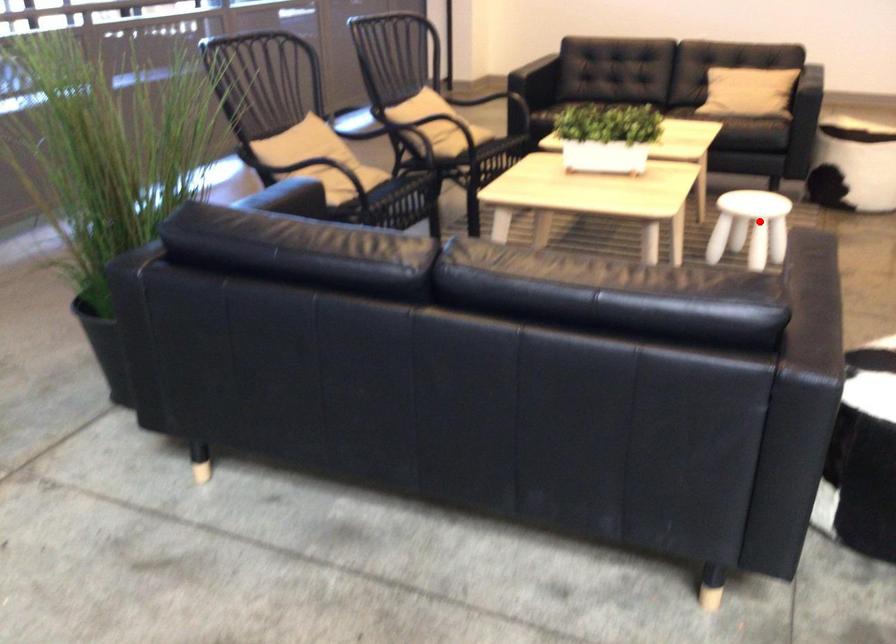
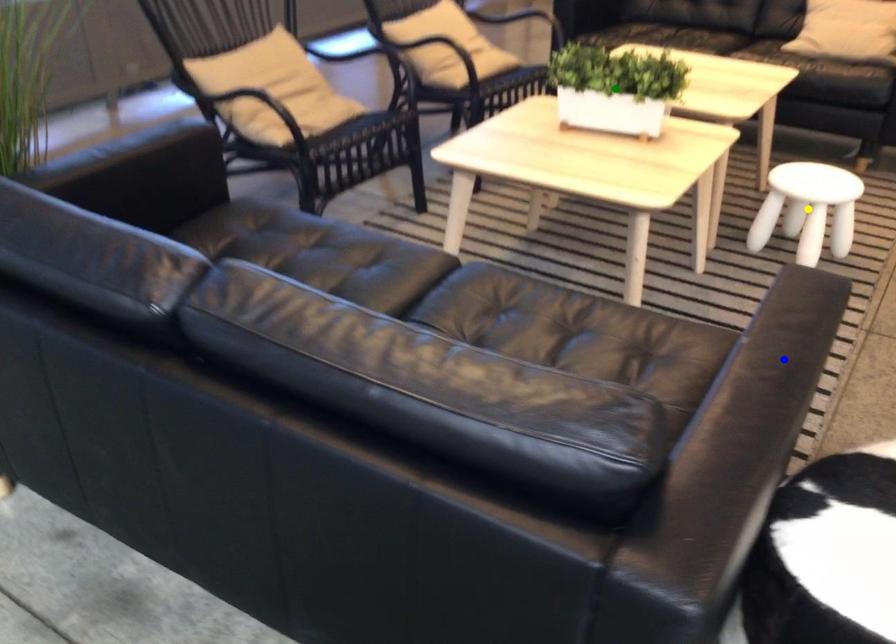
Question: I am providing you with two images of the same scene from different viewpoints. A red point is marked on the first image. You are given multiple points on the second image. Which spot in image 2 lines up with the point in image 1?

Choices:
 (A) yellow point
 (B) blue point
 (C) green point

Answer: (A)